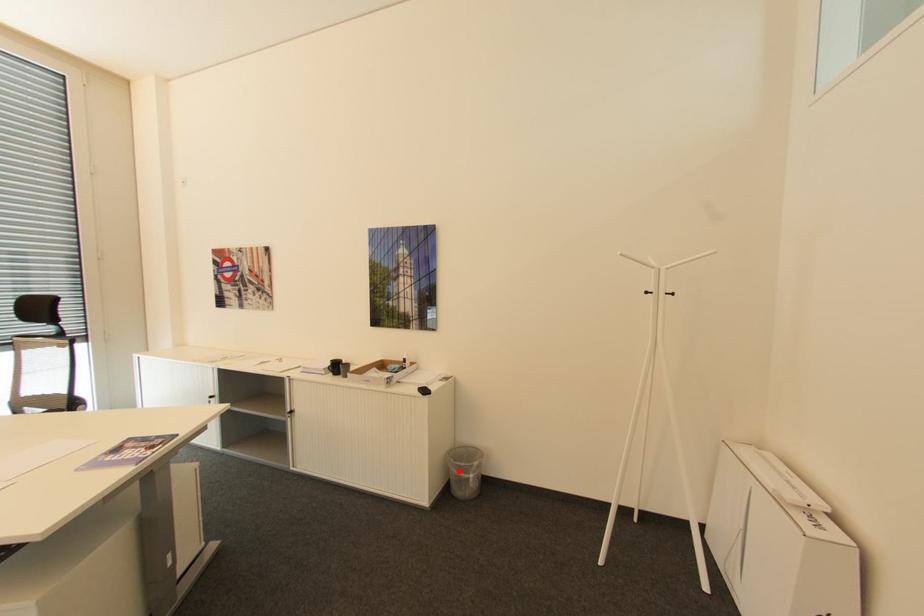
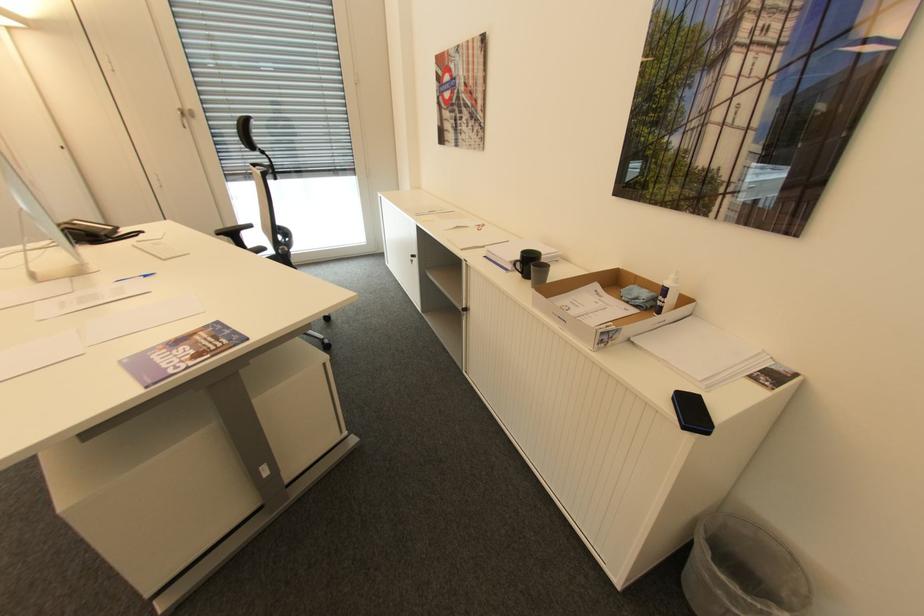
Question: A red point is marked in image1. In image2, is the corresponding 3D point closer to the camera or farther? Reply with the corresponding letter.

Choices:
 (A) The corresponding 3D point is closer.
 (B) The corresponding 3D point is farther.

Answer: (A)